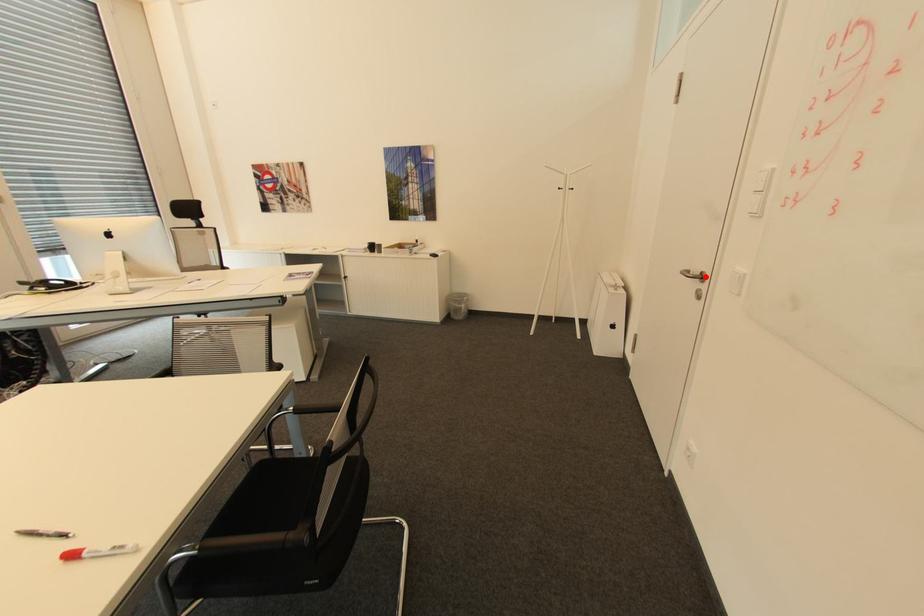
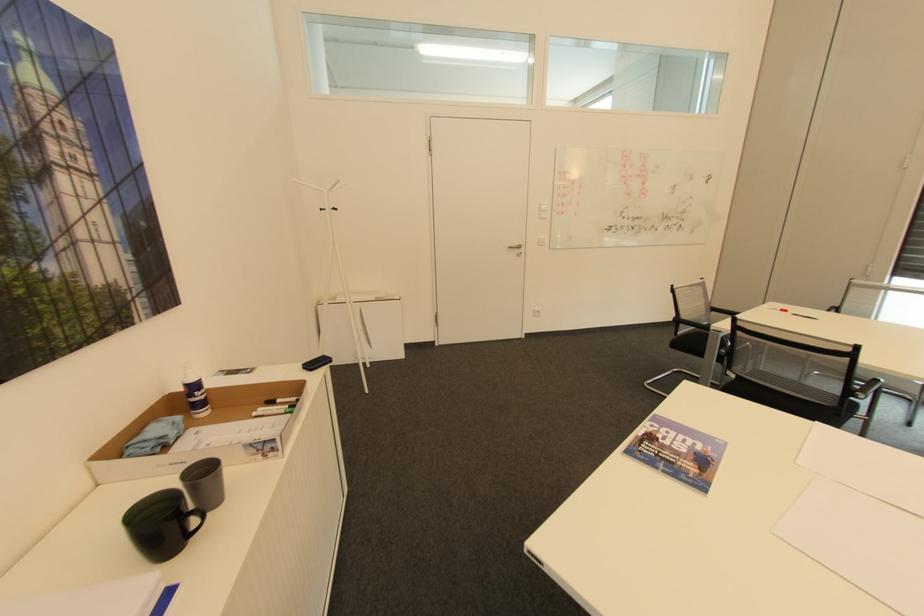
In the second image, find the point that corresponds to the highlighted location in the first image.

(524, 246)